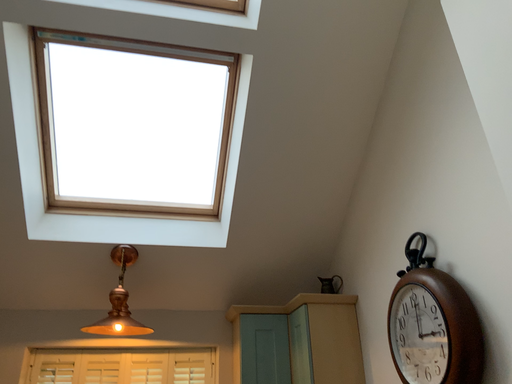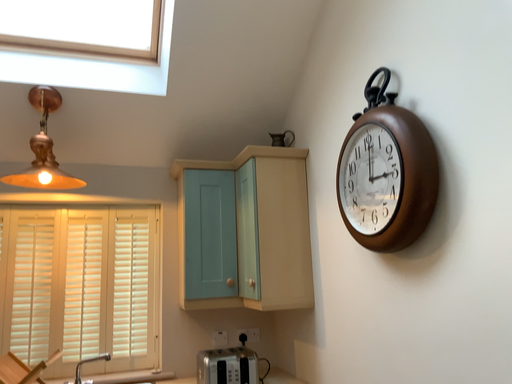
Question: How did the camera likely rotate when shooting the video?

Choices:
 (A) rotated upward
 (B) rotated downward

Answer: (B)